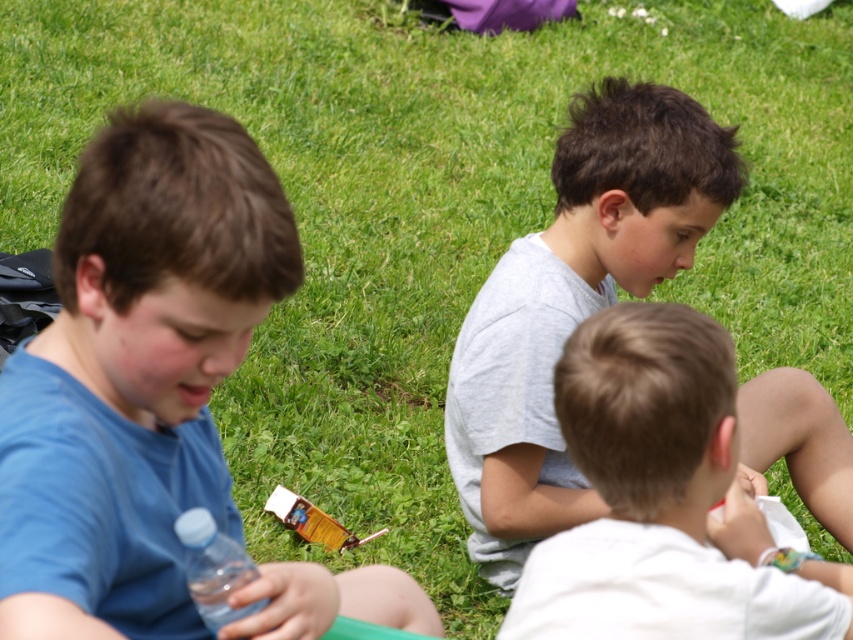
You are a photographer trying to capture a photo of the transparent plastic bottle at lower left without the white matte shirt at center blocking it. Based on their heights, is this possible?

The white matte shirt at center is taller than the transparent plastic bottle at lower left, so it might block the view. To avoid blocking, position the camera lower or move the bottle to a higher position.

You are a photographer trying to capture a group photo of the blue matte shirt at left and gray cotton shirt at center. If you want to ensure both shirts are clearly visible in the frame, which shirt should you position closer to the camera to avoid being too small in the photo?

The blue matte shirt at left should be positioned closer to the camera because it is narrower than the gray cotton shirt at center, so bringing it forward will help balance their sizes in the photo.

You are a photographer trying to capture a closeup of the transparent plastic bottle at lower left without including the white matte shirt at center in the frame. Based on their sizes, is it possible to do so?

The white matte shirt at center is larger in size than transparent plastic bottle at lower left, so it may be challenging to frame the bottle without including the shirt if they are positioned closely together.